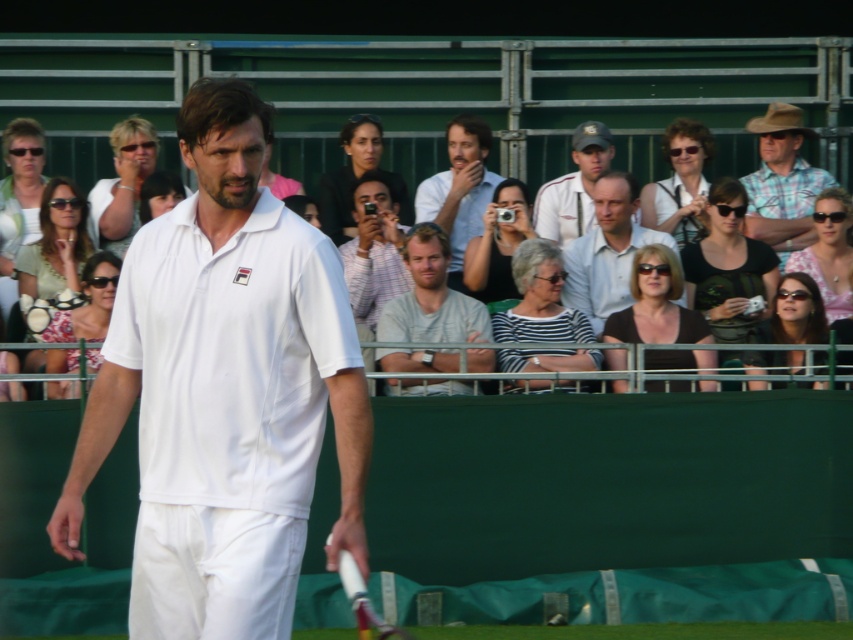
Question: In this image, where is white matte tennis shirt at center located relative to white shirt at center?

Choices:
 (A) right
 (B) left

Answer: (B)

Question: Which object is the farthest from the light brown hair at center?

Choices:
 (A) matte white shirt at center
 (B) black matte tank top at center
 (C) matte white sunglasses at upper center
 (D) plaid cotton shirt at upper right

Answer: (C)

Question: Can you confirm if white shirt at center is positioned above sunglasses at center?

Choices:
 (A) yes
 (B) no

Answer: (A)

Question: Which of the following is the farthest from the observer?

Choices:
 (A) (817, 353)
 (B) (837, 358)
 (C) (432, 260)
 (D) (61, 390)

Answer: (C)

Question: Can you confirm if black matte tank top at center is thinner than matte white sunglasses at upper center?

Choices:
 (A) no
 (B) yes

Answer: (A)

Question: Which point is closer to the camera?

Choices:
 (A) (109, 289)
 (B) (846, 339)
 (C) (672, 216)

Answer: (A)